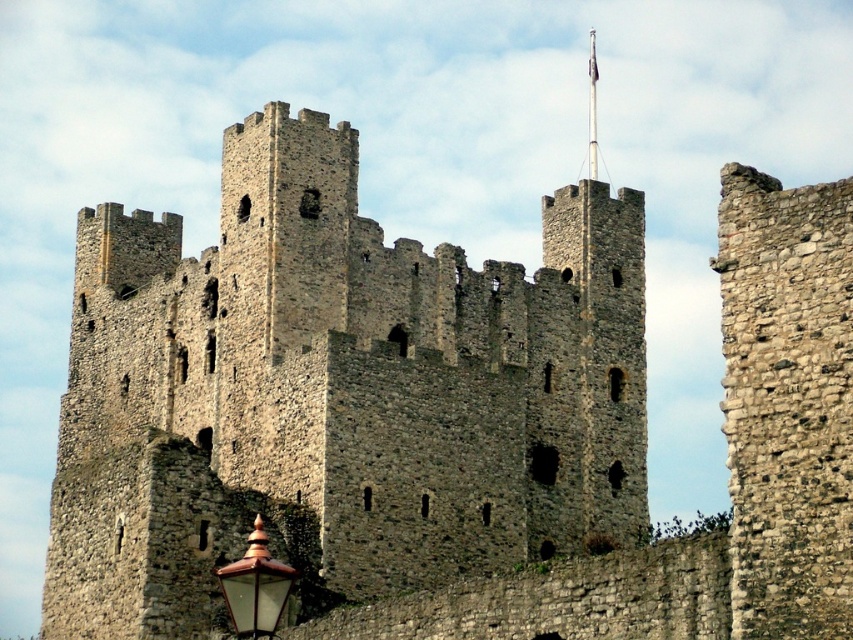
Does gray stone castle at center appear on the right side of polished brass lantern at lower left?

In fact, gray stone castle at center is to the left of polished brass lantern at lower left.

Looking at this image, does gray stone castle at center have a greater width compared to polished brass lantern at lower left?

Yes.

You are a GUI agent. You are given a task and a screenshot of the screen. Output one action in this format:
    pyautogui.click(x=<x>, y=<y>)
    Task: Click on the gray stone castle at center
    Image resolution: width=853 pixels, height=640 pixels.
    Given the screenshot: What is the action you would take?
    pyautogui.click(x=335, y=394)